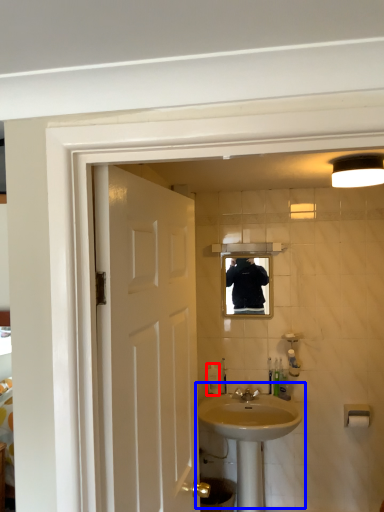
Question: Among these objects, which one is nearest to the camera, soap dispenser (highlighted by a red box) or sink (highlighted by a blue box)?

Choices:
 (A) soap dispenser
 (B) sink

Answer: (B)